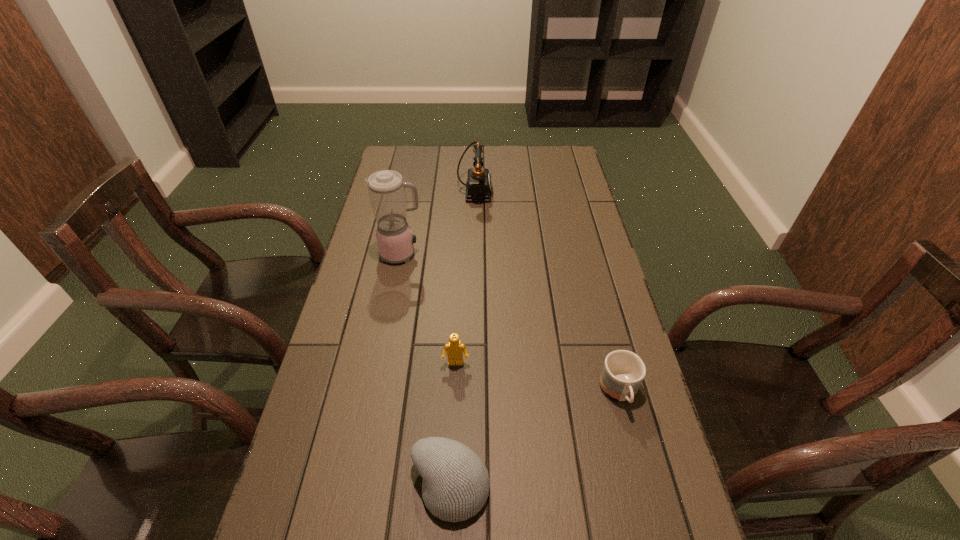
The width and height of the screenshot is (960, 540). I want to click on the leftmost object, so click(x=386, y=188).

Locate an element on the screen. the tallest object is located at coordinates (386, 188).

What are the coordinates of `telephone` in the screenshot? It's located at (479, 187).

At what (x,y) coordinates should I click in order to perform the action: click on the fourth shortest object. Please return your answer as a coordinate pair (x, y). Image resolution: width=960 pixels, height=540 pixels. Looking at the image, I should click on (479, 187).

Image resolution: width=960 pixels, height=540 pixels. What are the coordinates of `the third nearest object` in the screenshot? It's located at (454, 349).

You are a GUI agent. You are given a task and a screenshot of the screen. Output one action in this format:
    pyautogui.click(x=<x>, y=<y>)
    Task: Click on the nearest object
    
    Given the screenshot: What is the action you would take?
    pyautogui.click(x=455, y=486)

Image resolution: width=960 pixels, height=540 pixels. What are the coordinates of `the second nearest object` in the screenshot? It's located at (623, 371).

You are a GUI agent. You are given a task and a screenshot of the screen. Output one action in this format:
    pyautogui.click(x=<x>, y=<y>)
    Task: Click on the mug
    The width and height of the screenshot is (960, 540).
    Given the screenshot: What is the action you would take?
    pyautogui.click(x=623, y=371)

Locate an element on the screen. vacant area located 0.400m on the base of the tallest object near the control knob is located at coordinates (543, 254).

Locate an element on the screen. vacant space situated 0.120m on the front of the farthest object at the rotary dial is located at coordinates (523, 192).